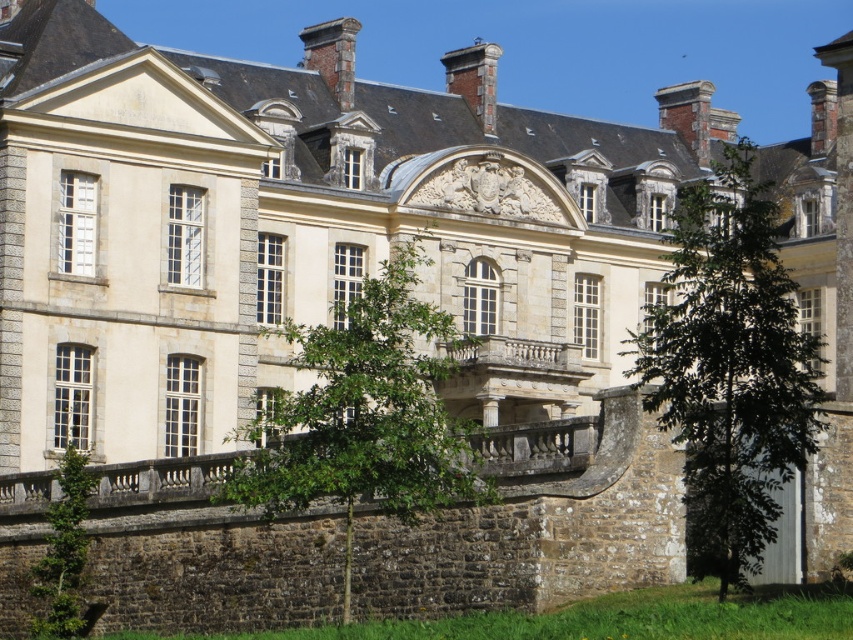
Question: Which object appears closest to the camera in this image?

Choices:
 (A) green leafy tree at center
 (B) green leafy tree at lower left
 (C) green leafy tree at right

Answer: (C)

Question: Is green leafy tree at right below green leafy tree at lower left?

Choices:
 (A) no
 (B) yes

Answer: (A)

Question: Which of the following is the farthest from the observer?

Choices:
 (A) 82,467
 (B) 329,449

Answer: (A)

Question: In this image, where is green leafy tree at right located relative to green leafy tree at lower left?

Choices:
 (A) left
 (B) right

Answer: (B)

Question: Is green leafy tree at center closer to camera compared to green leafy tree at lower left?

Choices:
 (A) yes
 (B) no

Answer: (A)

Question: Which point is closer to the camera?

Choices:
 (A) (71, 570)
 (B) (726, 508)

Answer: (B)